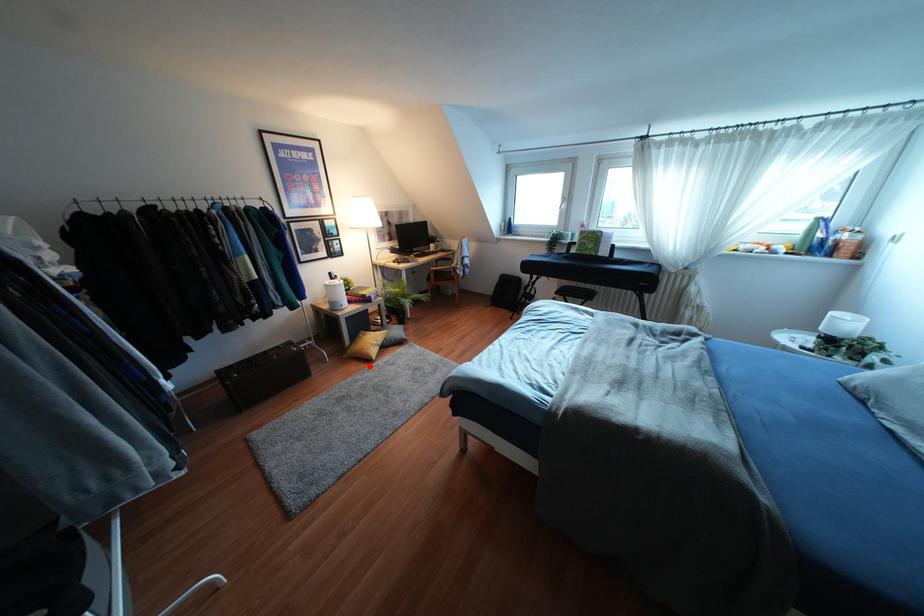
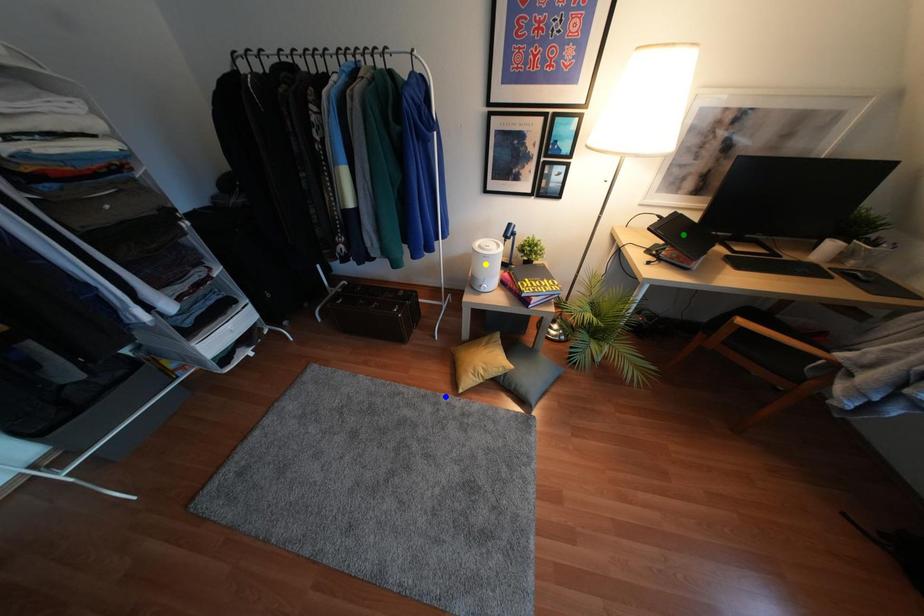
Question: I am providing you with two images of the same scene from different viewpoints. A red point is marked on the first image. You are given multiple points on the second image. Which point in image 2 represents the same 3d spot as the red point in image 1?

Choices:
 (A) blue point
 (B) green point
 (C) yellow point

Answer: (A)